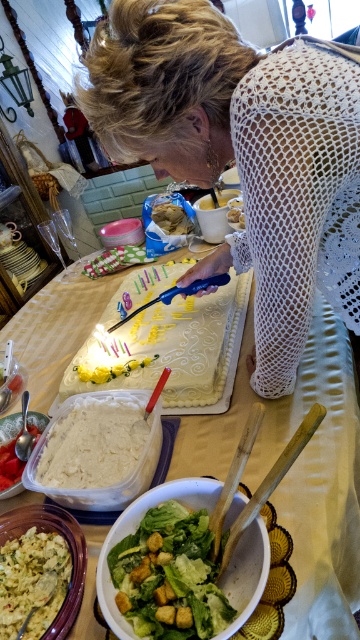
Consider the image. You are a guest at the celebration and want to choose a dessert that requires less effort to eat. Based on their sizes, which dessert would you pick between the white textured cake at center and the yellow crumbly bread at lower left?

The yellow crumbly bread at lower left is smaller than the white textured cake at center, so it requires less effort to eat.

You are a guest at the celebration and want to reach for the white creamy mashed potatoes at center. From your current position, which direction should you move to get to it?

The white creamy mashed potatoes at center is located at point 0.723 on the x and 0.244 on the y axis. Since the exact coordinates are provided, you should move towards those coordinates to reach it.

You are a photographer standing at a distance of 20 inches from the table. You want to take a closeup photo of the white textured cake at center. Based on the scene description, will you need to move closer or farther away to get the cake into focus?

The white textured cake at center is 22.43 inches from viewer. Since you are currently 20 inches away, you need to move 2.43 inches farther away to match the distance for the cake to be in focus.